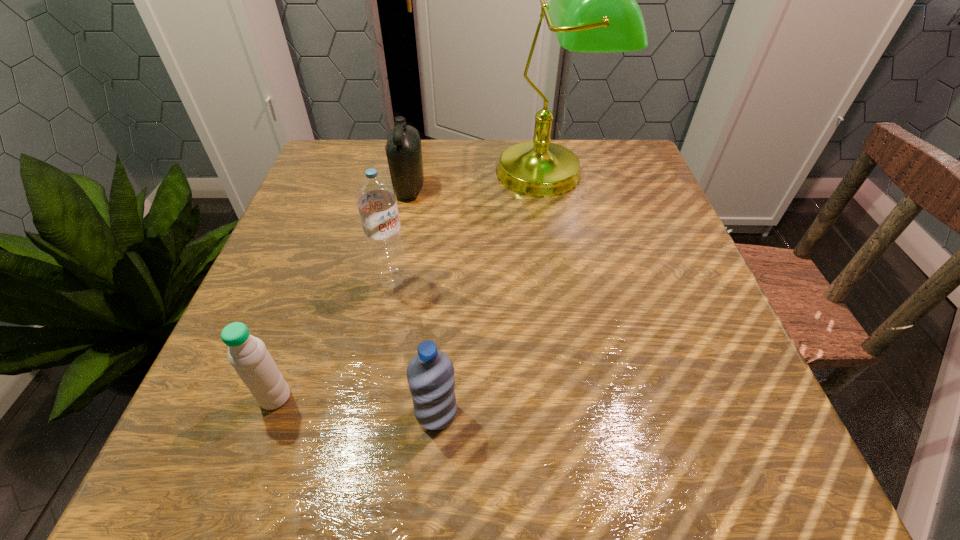
This screenshot has width=960, height=540. I want to click on vacant area located 0.190m on the right of the leftmost water bottle, so click(418, 397).

The image size is (960, 540). In order to click on vacant area located 0.210m on the left of the second object from right to left in this screenshot , I will do `click(271, 413)`.

At what (x,y) coordinates should I click in order to perform the action: click on lamp that is at the far edge. Please return your answer as a coordinate pair (x, y). This screenshot has width=960, height=540. Looking at the image, I should click on (593, 8).

Image resolution: width=960 pixels, height=540 pixels. I want to click on bottle that is at the far edge, so click(x=403, y=149).

Identify the location of object present at the near edge. (430, 374).

Find the location of a particular element. The height and width of the screenshot is (540, 960). object that is at the left edge is located at coordinates (248, 355).

You are a GUI agent. You are given a task and a screenshot of the screen. Output one action in this format:
    pyautogui.click(x=<x>, y=<y>)
    Task: Click on the object at the right edge
    The image size is (960, 540).
    Given the screenshot: What is the action you would take?
    pyautogui.click(x=593, y=8)

You are a GUI agent. You are given a task and a screenshot of the screen. Output one action in this format:
    pyautogui.click(x=<x>, y=<y>)
    Task: Click on the object present at the far right corner
    This screenshot has width=960, height=540.
    Given the screenshot: What is the action you would take?
    pyautogui.click(x=593, y=8)

The height and width of the screenshot is (540, 960). Identify the location of vacant space at the far edge. (458, 173).

Where is `free space at the right edge of the desktop`? Image resolution: width=960 pixels, height=540 pixels. free space at the right edge of the desktop is located at coordinates (644, 286).